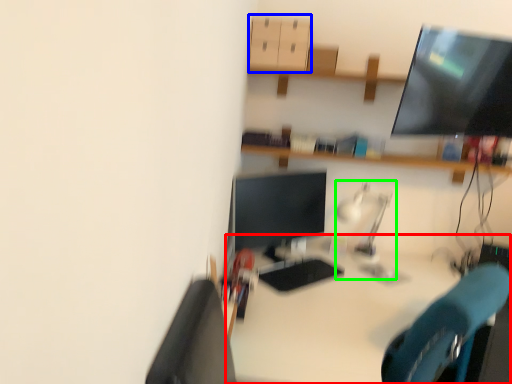
Question: Which object is positioned closest to desk (highlighted by a red box)? Select from drawer (highlighted by a blue box) and table lamp (highlighted by a green box).

Choices:
 (A) drawer
 (B) table lamp

Answer: (B)